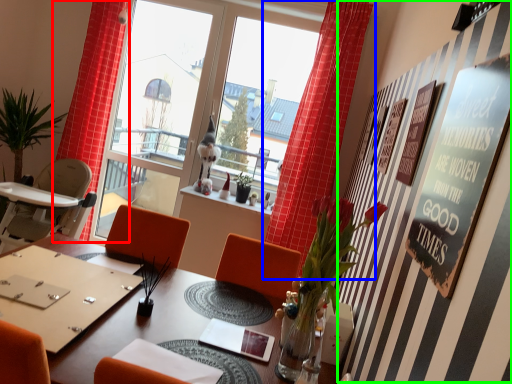
Question: Which object is positioned closest to curtain (highlighted by a red box)? Select from curtain (highlighted by a blue box) and bulletin board (highlighted by a green box).

Choices:
 (A) curtain
 (B) bulletin board

Answer: (A)